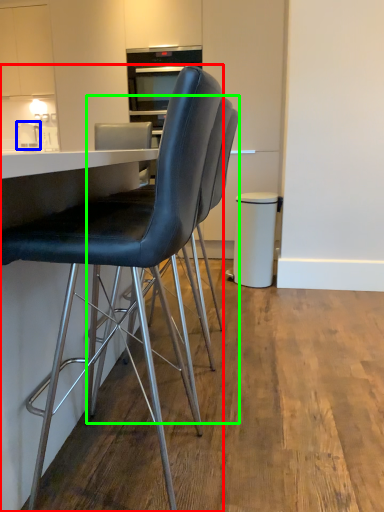
Question: Based on their relative distances, which object is farther from chair (highlighted by a red box)? Choose from appliance (highlighted by a blue box) and chair (highlighted by a green box).

Choices:
 (A) appliance
 (B) chair

Answer: (A)